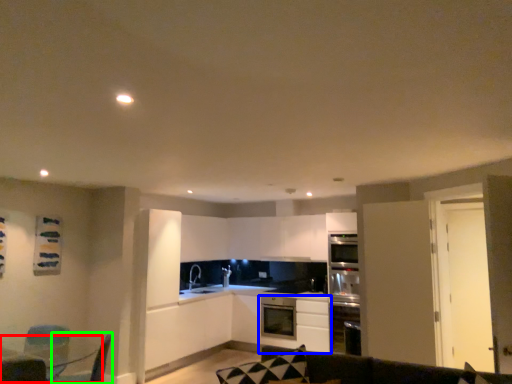
Question: Which object is the closest to the table (highlighted by a red box)? Choose among these: cabinetry (highlighted by a blue box) or swivel chair (highlighted by a green box).

Choices:
 (A) cabinetry
 (B) swivel chair

Answer: (B)